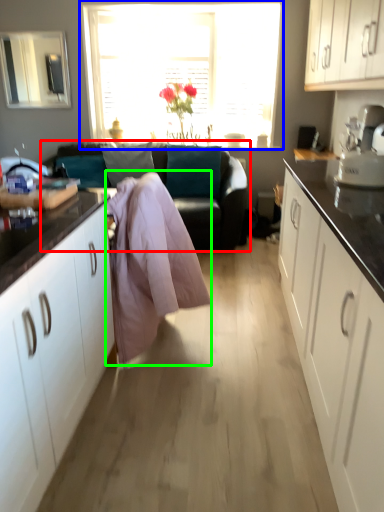
Question: Considering the real-world distances, which object is farthest from studio couch (highlighted by a red box)? window (highlighted by a blue box) or blanket (highlighted by a green box)?

Choices:
 (A) window
 (B) blanket

Answer: (B)